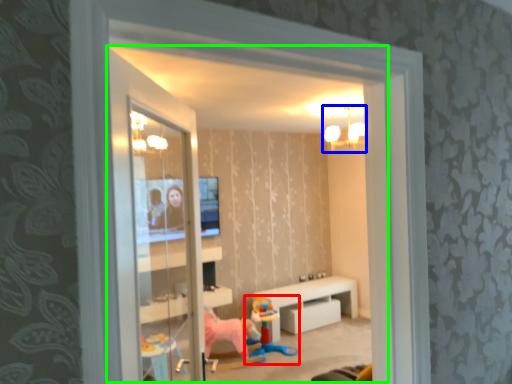
Question: Estimate the real-world distances between objects in this image. Which object is closer to toy (highlighted by a red box), light fixture (highlighted by a blue box) or window (highlighted by a green box)?

Choices:
 (A) light fixture
 (B) window

Answer: (B)